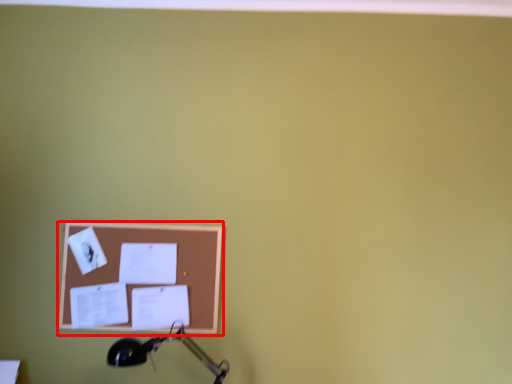
Question: In this image, where is picture frame (annotated by the red box) located relative to table lamp?

Choices:
 (A) right
 (B) left

Answer: (B)